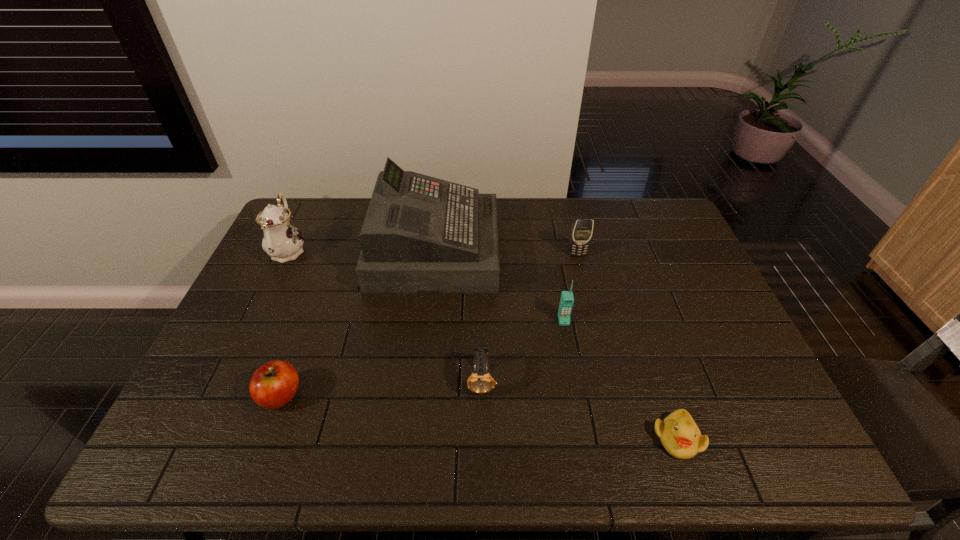
Find the location of a particular element. the nearest object is located at coordinates (680, 436).

Image resolution: width=960 pixels, height=540 pixels. What are the coordinates of `vacant space located 0.390m on the front-facing side of the cash register` in the screenshot? It's located at (615, 251).

Locate an element on the screen. The width and height of the screenshot is (960, 540). free spot located on the front of the leftmost object is located at coordinates (243, 345).

You are a GUI agent. You are given a task and a screenshot of the screen. Output one action in this format:
    pyautogui.click(x=<x>, y=<y>)
    Task: Click on the blank area located on the front face of the farther cellular telephone
    The image size is (960, 540).
    Given the screenshot: What is the action you would take?
    pyautogui.click(x=600, y=347)

At what (x,y) coordinates should I click in order to perform the action: click on free space located on the keypad of the nearer cellular telephone. Please return your answer as a coordinate pair (x, y). The width and height of the screenshot is (960, 540). Looking at the image, I should click on (583, 427).

Locate an element on the screen. The image size is (960, 540). vacant area located on the face of the watch is located at coordinates (482, 465).

The image size is (960, 540). I want to click on free region located on the back of the apple, so click(310, 316).

Find the location of a particular element. cash register that is positioned at the far edge is located at coordinates tap(421, 234).

You are a GUI agent. You are given a task and a screenshot of the screen. Output one action in this format:
    pyautogui.click(x=<x>, y=<y>)
    Task: Click on the chinaware that is at the far edge
    Image resolution: width=960 pixels, height=540 pixels.
    Given the screenshot: What is the action you would take?
    pyautogui.click(x=282, y=241)

You are a GUI agent. You are given a task and a screenshot of the screen. Output one action in this format:
    pyautogui.click(x=<x>, y=<y>)
    Task: Click on the object that is at the near edge
    The image size is (960, 540).
    Given the screenshot: What is the action you would take?
    pos(680,436)